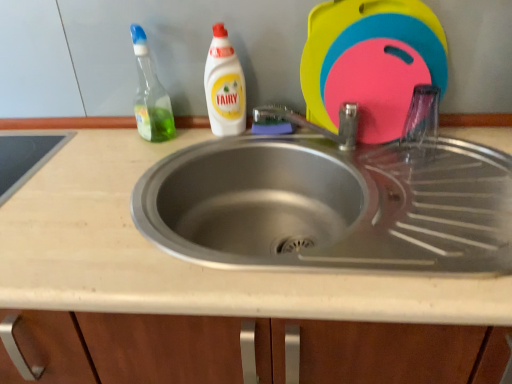
Question: Looking at their shapes, would you say green translucent bottle at upper left, acting as the second cleaning product starting from the right, is wider or thinner than beige laminate countertop at center?

Choices:
 (A) wide
 (B) thin

Answer: (B)

Question: Is green translucent bottle at upper left, acting as the second cleaning product starting from the right, situated inside beige laminate countertop at center or outside?

Choices:
 (A) outside
 (B) inside

Answer: (A)

Question: Which is nearer to the white plastic bottle at upper center, positioned as the 1th cleaning product in right-to-left order?

Choices:
 (A) green translucent bottle at upper left, placed as the 1th cleaning product when sorted from left to right
 (B) beige laminate countertop at center

Answer: (A)

Question: Which of these objects is positioned farthest from the beige laminate countertop at center?

Choices:
 (A) white plastic bottle at upper center, positioned as the 1th cleaning product in right-to-left order
 (B) green translucent bottle at upper left, acting as the second cleaning product starting from the right

Answer: (A)